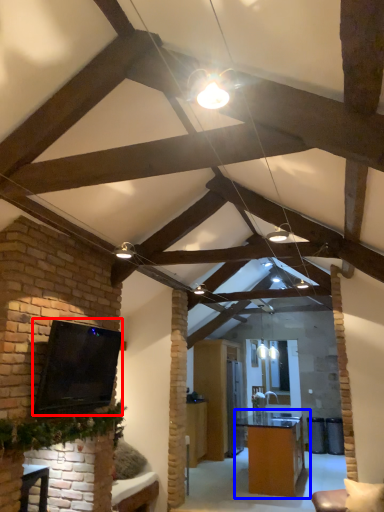
Question: Among these objects, which one is nearest to the camera, open (highlighted by a red box) or table (highlighted by a blue box)?

Choices:
 (A) open
 (B) table

Answer: (A)